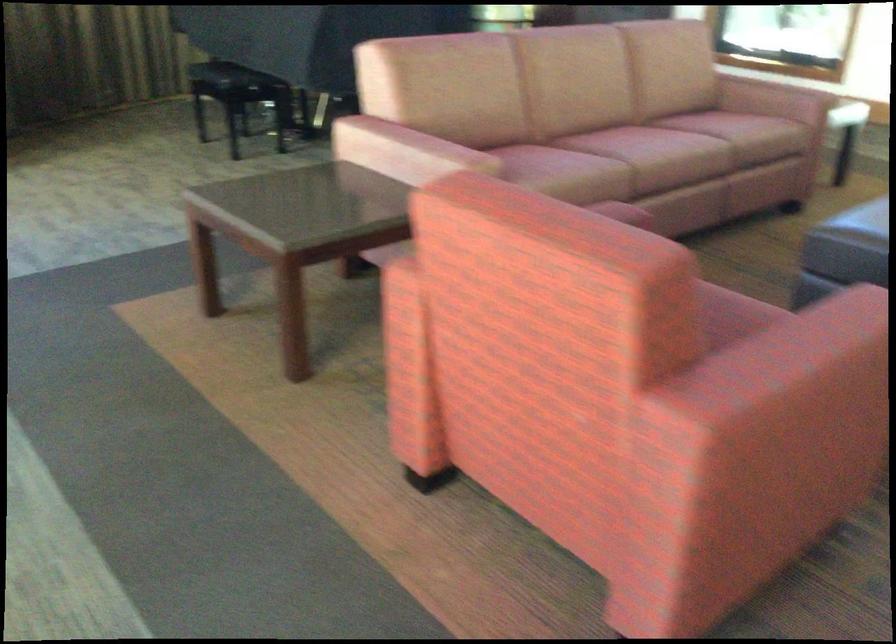
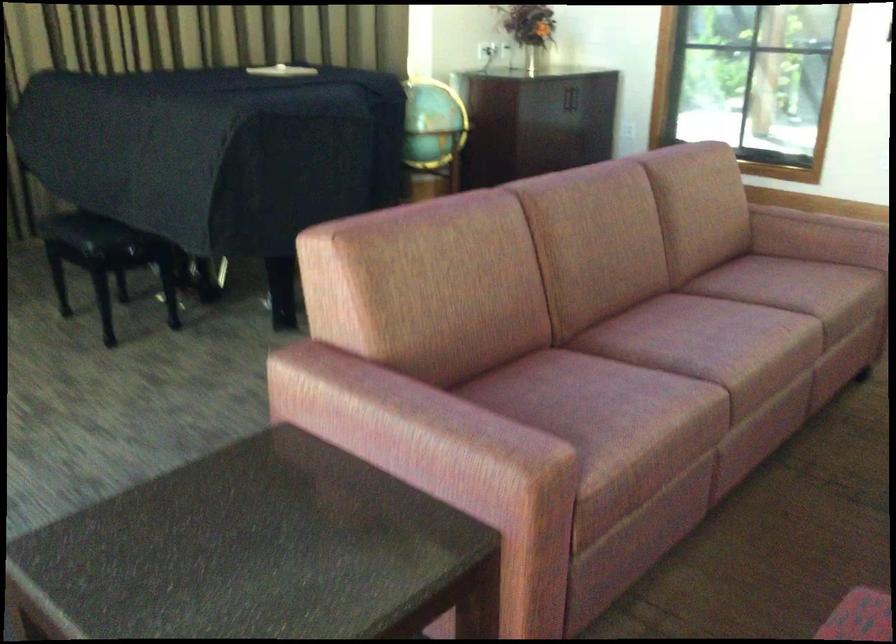
Question: The images are taken continuously from a first-person perspective. In which direction are you moving?

Choices:
 (A) Left
 (B) Right
 (C) Forward
 (D) Backward

Answer: (C)